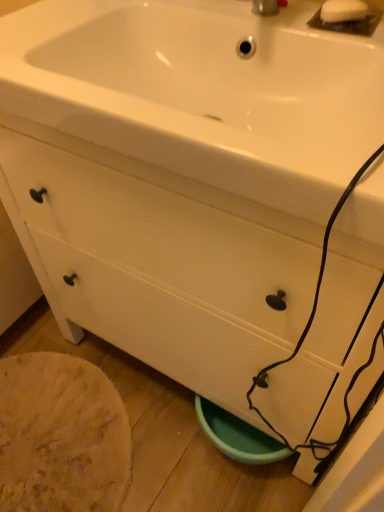
Question: Is white matte soap at upper right in front of white matte drawer at lower center?

Choices:
 (A) no
 (B) yes

Answer: (B)

Question: Is white matte soap at upper right outside of white matte drawer at lower center?

Choices:
 (A) no
 (B) yes

Answer: (B)

Question: Does white matte soap at upper right contain white matte drawer at lower center?

Choices:
 (A) no
 (B) yes

Answer: (A)

Question: Is the depth of white matte soap at upper right greater than that of white matte drawer at lower center?

Choices:
 (A) no
 (B) yes

Answer: (A)

Question: Is white matte soap at upper right far away from white matte drawer at lower center?

Choices:
 (A) yes
 (B) no

Answer: (B)

Question: Is white matte soap at upper right taller or shorter than white matte drawer at lower center?

Choices:
 (A) short
 (B) tall

Answer: (A)

Question: From a real-world perspective, is white matte soap at upper right positioned above or below white matte drawer at lower center?

Choices:
 (A) below
 (B) above

Answer: (B)

Question: In the image, is white matte soap at upper right positioned in front of or behind white matte drawer at lower center?

Choices:
 (A) behind
 (B) front

Answer: (B)

Question: Visually, is white matte soap at upper right positioned to the left or to the right of white matte drawer at lower center?

Choices:
 (A) right
 (B) left

Answer: (A)

Question: From the image's perspective, is white glossy sink at upper center positioned above or below white matte soap at upper right?

Choices:
 (A) below
 (B) above

Answer: (A)

Question: In terms of height, does white glossy sink at upper center look taller or shorter compared to white matte soap at upper right?

Choices:
 (A) short
 (B) tall

Answer: (B)

Question: Relative to white matte soap at upper right, is white glossy sink at upper center in front or behind?

Choices:
 (A) front
 (B) behind

Answer: (A)

Question: In terms of size, does white glossy sink at upper center appear bigger or smaller than white matte soap at upper right?

Choices:
 (A) big
 (B) small

Answer: (A)

Question: From the image's perspective, is white matte soap at upper right above or below white glossy sink at upper center?

Choices:
 (A) below
 (B) above

Answer: (B)

Question: Considering the positions of white matte soap at upper right and white glossy sink at upper center in the image, is white matte soap at upper right taller or shorter than white glossy sink at upper center?

Choices:
 (A) tall
 (B) short

Answer: (B)